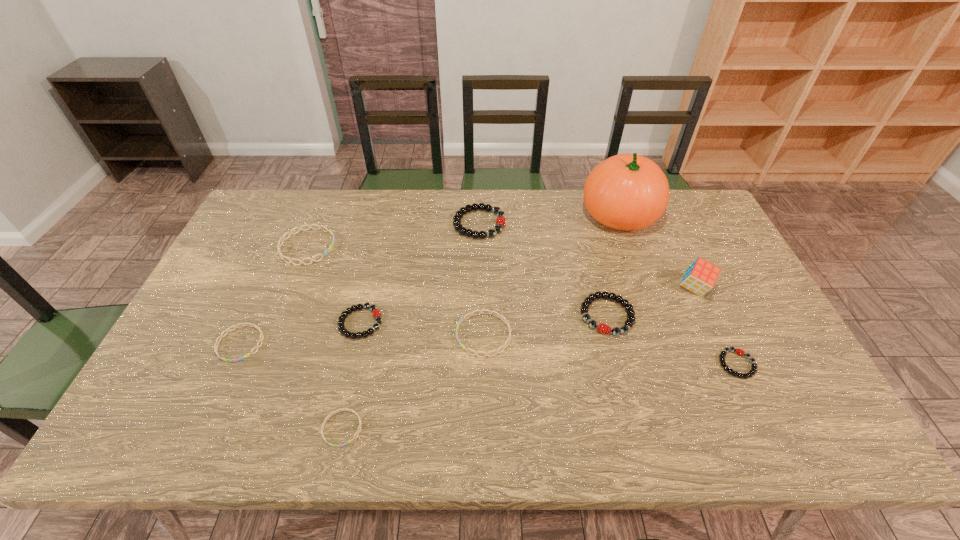
You are a GUI agent. You are given a task and a screenshot of the screen. Output one action in this format:
    pyautogui.click(x=<x>, y=<y>)
    Task: Click on the object at the far left corner
    
    Given the screenshot: What is the action you would take?
    pyautogui.click(x=283, y=238)

This screenshot has height=540, width=960. What are the coordinates of `vacant space at the far edge of the desktop` in the screenshot? It's located at (450, 195).

The width and height of the screenshot is (960, 540). Identify the location of free space at the near edge of the desktop. (442, 415).

Where is `vacant space at the left edge of the desktop`? This screenshot has height=540, width=960. vacant space at the left edge of the desktop is located at coordinates click(275, 265).

Find the location of a particular element. vacant space at the right edge of the desktop is located at coordinates (684, 238).

Locate an element on the screen. The width and height of the screenshot is (960, 540). blank space at the far left corner is located at coordinates (264, 222).

Image resolution: width=960 pixels, height=540 pixels. I want to click on free space between the third biggest blue bracelet and the third smallest black bracelet, so click(423, 330).

The width and height of the screenshot is (960, 540). Identify the location of blank region between the farthest blue bracelet and the rightmost black bracelet. (522, 306).

Locate an element on the screen. free spot between the pumpkin and the second tallest object is located at coordinates (657, 252).

This screenshot has height=540, width=960. I want to click on unoccupied area between the leftmost black bracelet and the tallest bracelet, so click(420, 273).